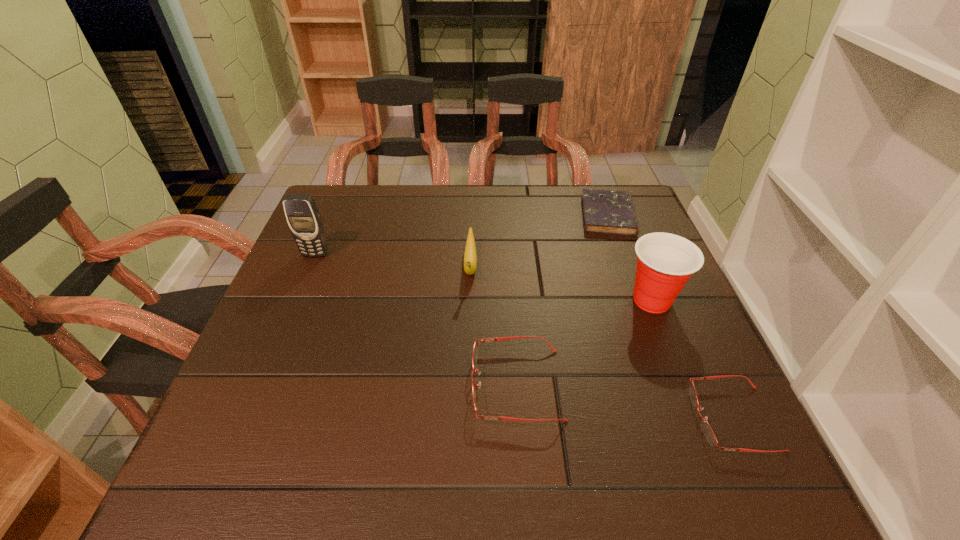
This screenshot has width=960, height=540. Find the location of `vacant space at the right edge of the desktop`. vacant space at the right edge of the desktop is located at coordinates (630, 313).

Find the location of a particular element. The image size is (960, 540). free space at the far left corner of the desktop is located at coordinates (331, 195).

Where is `vacant region at the near right corner of the desktop`? The image size is (960, 540). vacant region at the near right corner of the desktop is located at coordinates (699, 432).

This screenshot has width=960, height=540. Identify the location of free space between the tallest object and the left spectacles. click(416, 319).

The width and height of the screenshot is (960, 540). I want to click on vacant space that is in between the left spectacles and the cup, so click(585, 342).

The image size is (960, 540). Find the location of `vacant space in between the shorter spectacles and the left spectacles`. vacant space in between the shorter spectacles and the left spectacles is located at coordinates coord(625,401).

You are a GUI agent. You are given a task and a screenshot of the screen. Output one action in this format:
    pyautogui.click(x=<x>, y=<y>)
    Task: Click on the empty space that is in between the leftmost object and the fourth shortest object
    The image size is (960, 540).
    Given the screenshot: What is the action you would take?
    pyautogui.click(x=393, y=260)

Find the location of `free space between the fifth tallest object and the fourth shortest object`. free space between the fifth tallest object and the fourth shortest object is located at coordinates (602, 342).

This screenshot has width=960, height=540. What are the coordinates of `vacant point located between the left spectacles and the second tallest object` in the screenshot? It's located at (585, 342).

Locate an element on the screen. vacant area between the taller spectacles and the second tallest object is located at coordinates (585, 342).